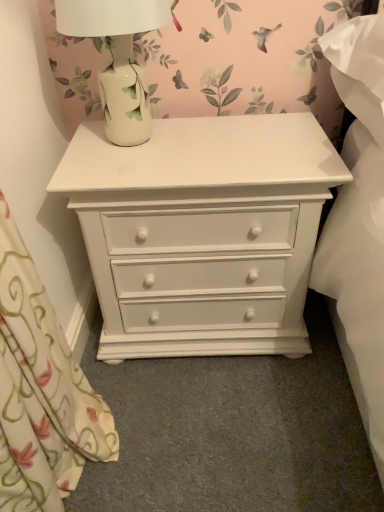
Question: Is white ceramic lamp at upper left to the left of white painted wood chest of drawers at center from the viewer's perspective?

Choices:
 (A) yes
 (B) no

Answer: (A)

Question: Is white ceramic lamp at upper left smaller than white painted wood chest of drawers at center?

Choices:
 (A) no
 (B) yes

Answer: (B)

Question: Considering the relative sizes of white ceramic lamp at upper left and white painted wood chest of drawers at center in the image provided, is white ceramic lamp at upper left taller than white painted wood chest of drawers at center?

Choices:
 (A) no
 (B) yes

Answer: (A)

Question: Is the position of white ceramic lamp at upper left more distant than that of white painted wood chest of drawers at center?

Choices:
 (A) no
 (B) yes

Answer: (A)

Question: Can you confirm if white ceramic lamp at upper left is shorter than white painted wood chest of drawers at center?

Choices:
 (A) no
 (B) yes

Answer: (B)

Question: Can you confirm if white ceramic lamp at upper left is thinner than white painted wood chest of drawers at center?

Choices:
 (A) no
 (B) yes

Answer: (B)

Question: Is white painted wood chest of drawers at center shorter than white ceramic lamp at upper left?

Choices:
 (A) no
 (B) yes

Answer: (A)

Question: Is white painted wood chest of drawers at center positioned beyond the bounds of white ceramic lamp at upper left?

Choices:
 (A) yes
 (B) no

Answer: (A)

Question: Is white painted wood chest of drawers at center placed right next to white ceramic lamp at upper left?

Choices:
 (A) yes
 (B) no

Answer: (B)

Question: Is white painted wood chest of drawers at center wider than white ceramic lamp at upper left?

Choices:
 (A) no
 (B) yes

Answer: (B)

Question: From the image's perspective, is white painted wood chest of drawers at center above white ceramic lamp at upper left?

Choices:
 (A) no
 (B) yes

Answer: (A)

Question: Can you confirm if white painted wood chest of drawers at center is positioned to the left of white ceramic lamp at upper left?

Choices:
 (A) yes
 (B) no

Answer: (B)

Question: Based on their sizes in the image, would you say white ceramic lamp at upper left is bigger or smaller than white painted wood chest of drawers at center?

Choices:
 (A) big
 (B) small

Answer: (B)